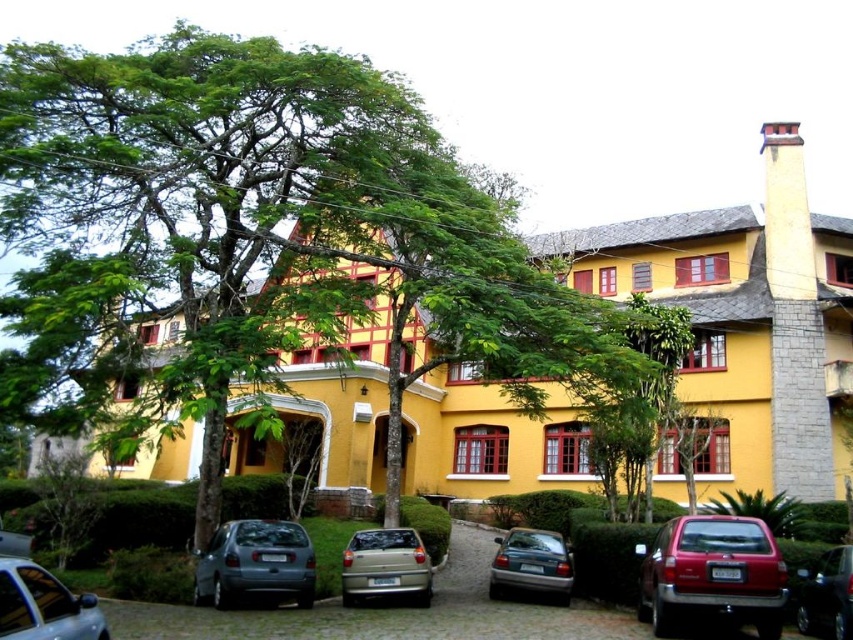
You are standing in front of the two story building and want to park your car. You see a shiny red suv at lower right and a metallic gray sedan at lower left. Which car is closer to you?

The shiny red suv at lower right is closer to you because it is further to the viewer than the metallic gray sedan at lower left.

You are driving a delivery van that is 6 meters long. You need to park your van in the parking spot between the shiny red suv at lower right and the metallic gray sedan at lower left. Can your van fit in that space?

The shiny red suv at lower right is bigger than metallic gray sedan at lower left, but the question is about the space between them. Since the description only mentions their sizes, not the distance between them, we cannot determine if the van will fit. More information about the space between the vehicles is needed.

You are standing in front of the two story building with a yellow facade. You see a green leafy tree at center and a teal metallic sedan at center. Which object is higher up in the scene?

The green leafy tree at center is located above the teal metallic sedan at center, so it is higher up in the scene.